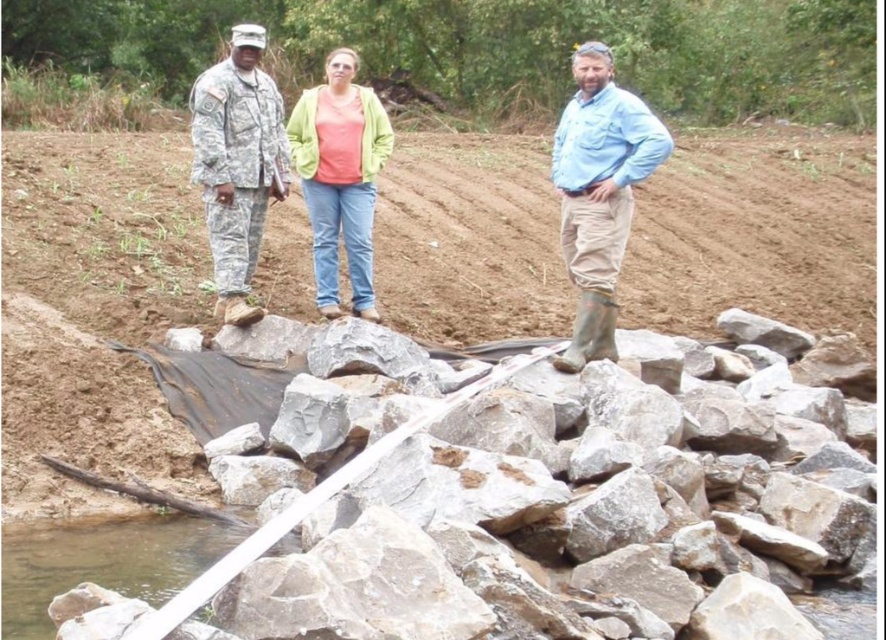
Measure the distance between camouflage fabric uniform at center and camera.

camouflage fabric uniform at center is 31.58 feet from camera.

You are a GUI agent. You are given a task and a screenshot of the screen. Output one action in this format:
    pyautogui.click(x=<x>, y=<y>)
    Task: Click on the camouflage fabric uniform at center
    This screenshot has width=886, height=640.
    Given the screenshot: What is the action you would take?
    pyautogui.click(x=237, y=164)

Is point (219, 164) more distant than point (24, 595)?

Yes, it is.

Identify the location of camouflage fabric uniform at center. (237, 164).

Who is higher up, gray rough rock at center or clear water at lower left?

gray rough rock at center

Is gray rough rock at center wider than clear water at lower left?

Yes.

This screenshot has width=886, height=640. Find the location of `gray rough rock at center`. gray rough rock at center is located at coordinates pos(558,515).

Does clear water at lower left come behind light green fabric jacket at center?

No, clear water at lower left is in front of light green fabric jacket at center.

Who is shorter, clear water at lower left or light green fabric jacket at center?

With less height is clear water at lower left.

Who is more distant from viewer, (8, 624) or (346, 51)?

Point (346, 51)

Identify the location of clear water at lower left. (102, 563).